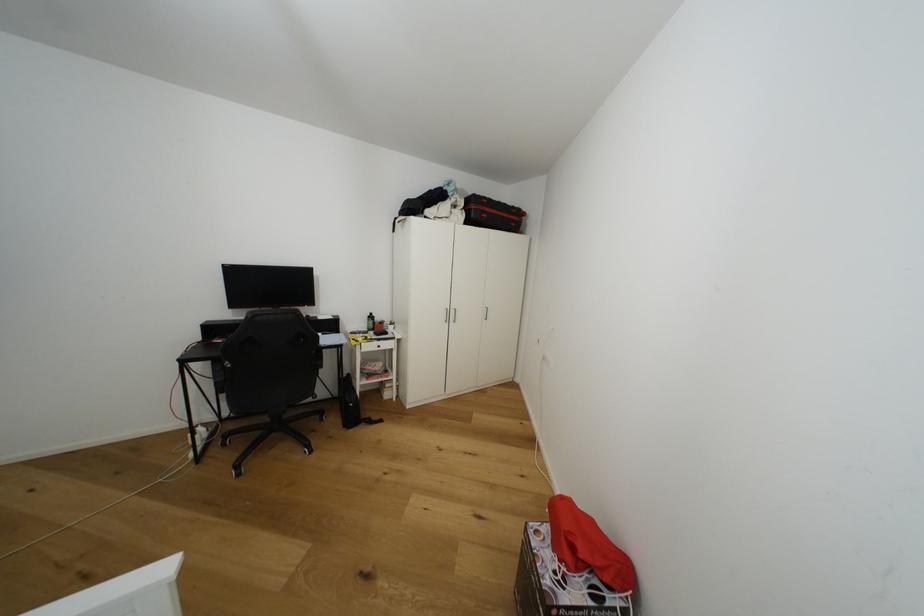
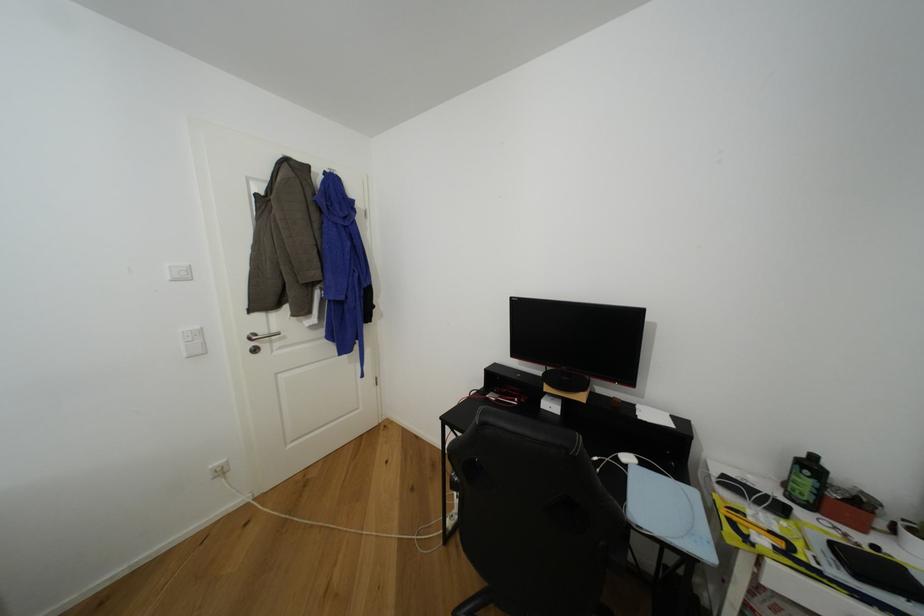
Where in the second image is the point corresponding to point (377, 315) from the first image?

(820, 459)